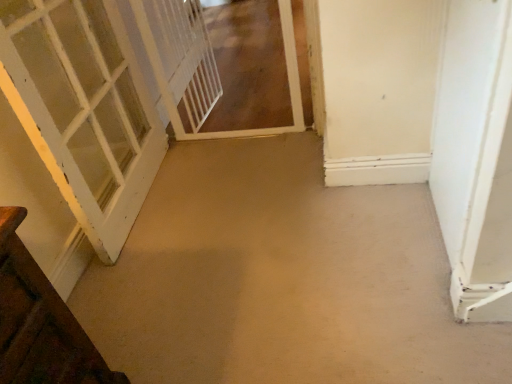
Question: Does white matte door at right, the 1th door when ordered from right to left, have a larger size compared to white mesh screen door at upper left, acting as the second screen door starting from the left?

Choices:
 (A) yes
 (B) no

Answer: (A)

Question: Does white matte door at right, which is counted as the 3th door, starting from the left, have a greater height compared to white mesh screen door at upper left, the 1th screen door viewed from the right?

Choices:
 (A) no
 (B) yes

Answer: (B)

Question: Considering the relative sizes of white matte door at right, the 1th door when ordered from right to left, and white mesh screen door at upper left, acting as the second screen door starting from the left, in the image provided, is white matte door at right, the 1th door when ordered from right to left, thinner than white mesh screen door at upper left, acting as the second screen door starting from the left,?

Choices:
 (A) yes
 (B) no

Answer: (A)

Question: Considering the relative positions of white matte door at right, the 1th door when ordered from right to left, and white mesh screen door at upper left, the 1th screen door viewed from the right, in the image provided, is white matte door at right, the 1th door when ordered from right to left, behind white mesh screen door at upper left, the 1th screen door viewed from the right,?

Choices:
 (A) yes
 (B) no

Answer: (B)

Question: Can you confirm if white matte door at right, which is counted as the 3th door, starting from the left, is shorter than white mesh screen door at upper left, the 1th screen door viewed from the right?

Choices:
 (A) no
 (B) yes

Answer: (A)

Question: From the image's perspective, would you say white matte door at right, which is counted as the 3th door, starting from the left, is shown under white mesh screen door at upper left, the 1th screen door viewed from the right?

Choices:
 (A) no
 (B) yes

Answer: (B)

Question: Is white matte door at right, which is counted as the 3th door, starting from the left, far from white mesh screen door at center, which ranks as the 1th screen door in left-to-right order?

Choices:
 (A) yes
 (B) no

Answer: (A)

Question: Considering the relative sizes of white matte door at right, which is counted as the 3th door, starting from the left, and white mesh screen door at center, which is the second screen door from right to left, in the image provided, is white matte door at right, which is counted as the 3th door, starting from the left, smaller than white mesh screen door at center, which is the second screen door from right to left,?

Choices:
 (A) yes
 (B) no

Answer: (B)

Question: Could white mesh screen door at center, which ranks as the 1th screen door in left-to-right order, be considered to be inside white matte door at right, which is counted as the 3th door, starting from the left?

Choices:
 (A) yes
 (B) no

Answer: (B)

Question: Does white matte door at right, the 1th door when ordered from right to left, have a lesser height compared to white mesh screen door at center, which ranks as the 1th screen door in left-to-right order?

Choices:
 (A) yes
 (B) no

Answer: (B)

Question: Does white matte door at right, which is counted as the 3th door, starting from the left, have a greater height compared to white mesh screen door at center, which ranks as the 1th screen door in left-to-right order?

Choices:
 (A) yes
 (B) no

Answer: (A)

Question: From a real-world perspective, is white matte door at right, the 1th door when ordered from right to left, located beneath white mesh screen door at center, which is the second screen door from right to left?

Choices:
 (A) no
 (B) yes

Answer: (A)

Question: Is white painted wood door at left, which is the third door in right-to-left order, aimed at beige carpet at center?

Choices:
 (A) no
 (B) yes

Answer: (B)